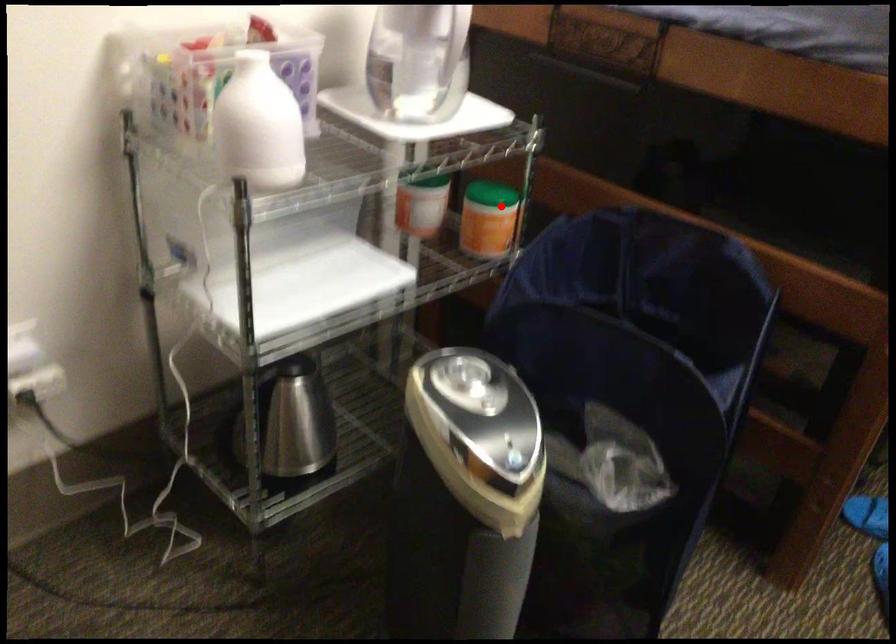
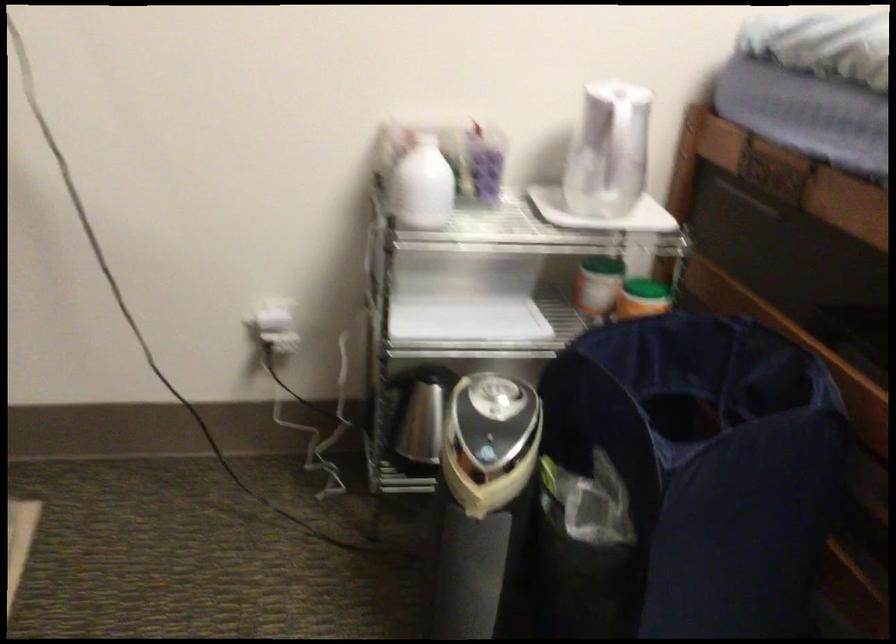
Question: I am providing you with two images of the same scene from different viewpoints. Image1 has a red point marked. In image2, the corresponding 3D location appears at what relative position? Reply with the corresponding letter.

Choices:
 (A) Closer
 (B) Farther

Answer: (B)